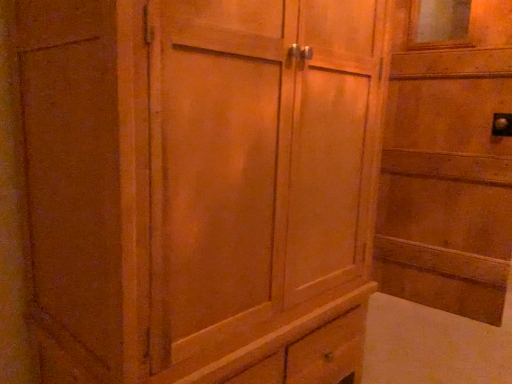
Question: Is wooden cabinet at center in front of or behind wooden door at right in the image?

Choices:
 (A) front
 (B) behind

Answer: (A)

Question: Is wooden cabinet at center to the left or to the right of wooden door at right in the image?

Choices:
 (A) left
 (B) right

Answer: (A)

Question: Considering the positions of point [x=269, y=216] and point [x=488, y=208], is point [x=269, y=216] closer or farther from the camera than point [x=488, y=208]?

Choices:
 (A) farther
 (B) closer

Answer: (B)

Question: From a real-world perspective, is wooden door at right physically located above or below wooden cabinet at center?

Choices:
 (A) above
 (B) below

Answer: (A)

Question: Considering the relative positions of wooden door at right and wooden cabinet at center in the image provided, is wooden door at right to the left or to the right of wooden cabinet at center?

Choices:
 (A) left
 (B) right

Answer: (B)

Question: From the image's perspective, relative to wooden cabinet at center, is wooden door at right above or below?

Choices:
 (A) above
 (B) below

Answer: (A)

Question: Does point (483, 288) appear closer or farther from the camera than point (231, 311)?

Choices:
 (A) farther
 (B) closer

Answer: (A)